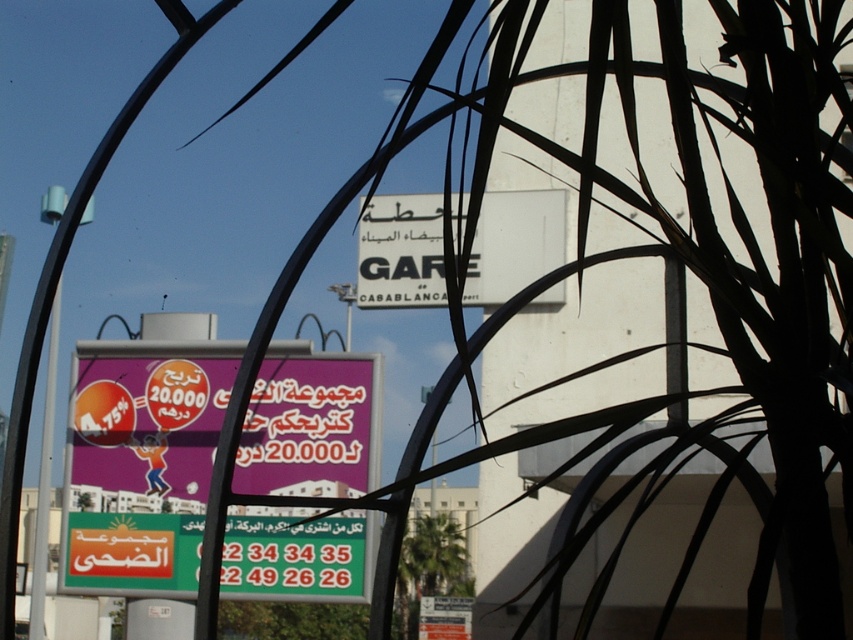
Image resolution: width=853 pixels, height=640 pixels. What do you see at coordinates (141, 461) in the screenshot? I see `purple glossy signboard at center` at bounding box center [141, 461].

Can you confirm if purple glossy signboard at center is bigger than white matte sign at center?

Correct, purple glossy signboard at center is larger in size than white matte sign at center.

Is point (137, 516) positioned before point (376, 224)?

Yes, point (137, 516) is closer to viewer.

This screenshot has height=640, width=853. I want to click on purple glossy signboard at center, so click(x=141, y=461).